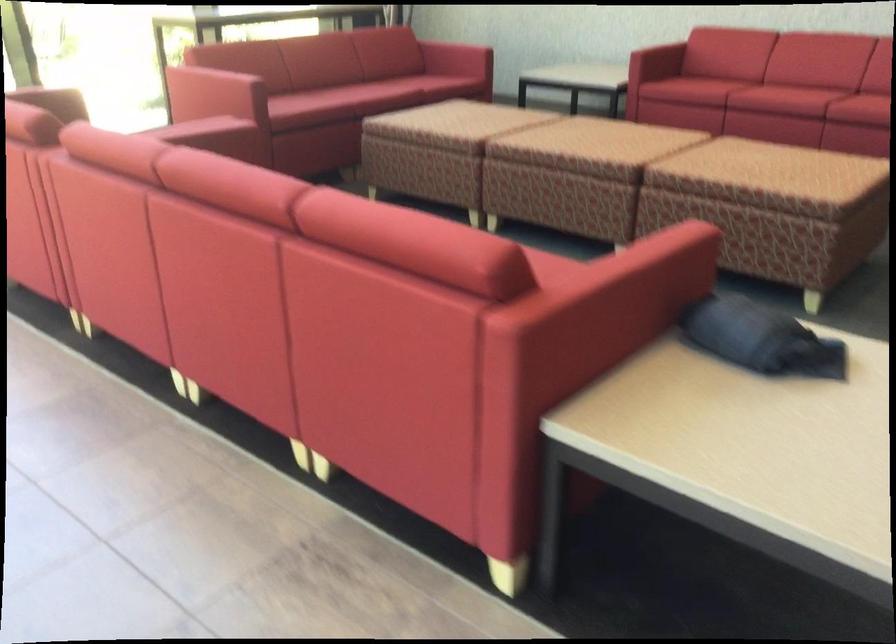
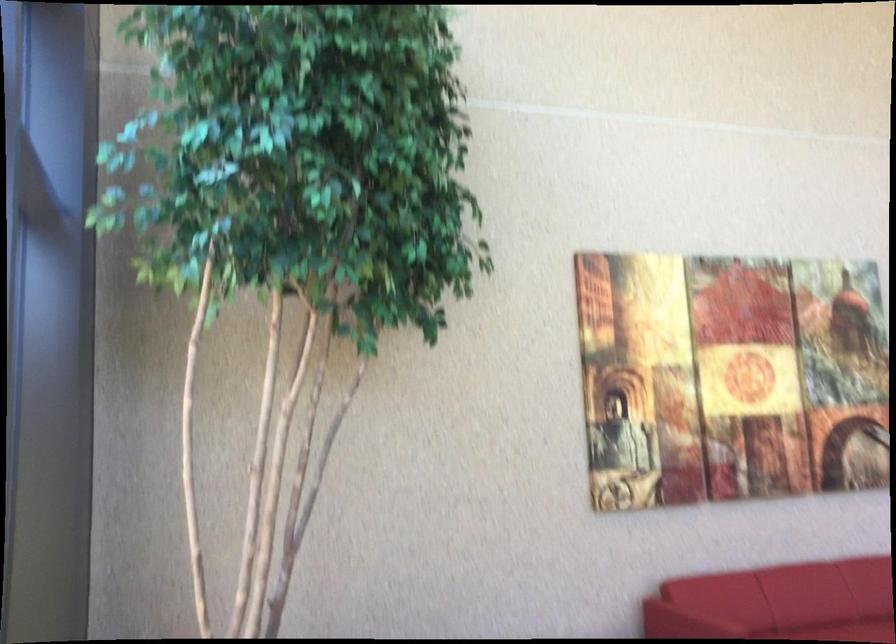
Question: The images are taken continuously from a first-person perspective. In which direction are you moving?

Choices:
 (A) Left
 (B) Right
 (C) Forward
 (D) Backward

Answer: (D)